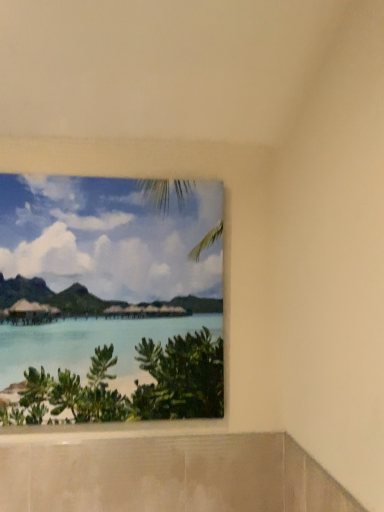
In order to face matte tropical beach scene at upper left, should I rotate leftwards or rightwards?

Turn left approximately 10.109 degrees to face it.

Measure the distance between point (x=135, y=355) and camera.

1.42 meters.

The image size is (384, 512). What do you see at coordinates (110, 294) in the screenshot?
I see `matte tropical beach scene at upper left` at bounding box center [110, 294].

Locate an element on the screen. The image size is (384, 512). matte tropical beach scene at upper left is located at coordinates (110, 294).

The height and width of the screenshot is (512, 384). What are the coordinates of `matte tropical beach scene at upper left` in the screenshot? It's located at (x=110, y=294).